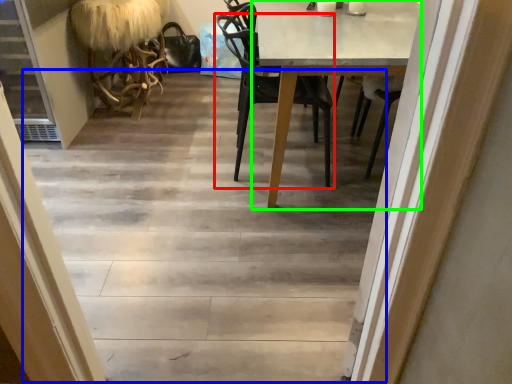
Question: Estimate the real-world distances between objects in this image. Which object is farther from chair (highlighted by a red box), stairwell (highlighted by a blue box) or round table (highlighted by a green box)?

Choices:
 (A) stairwell
 (B) round table

Answer: (A)